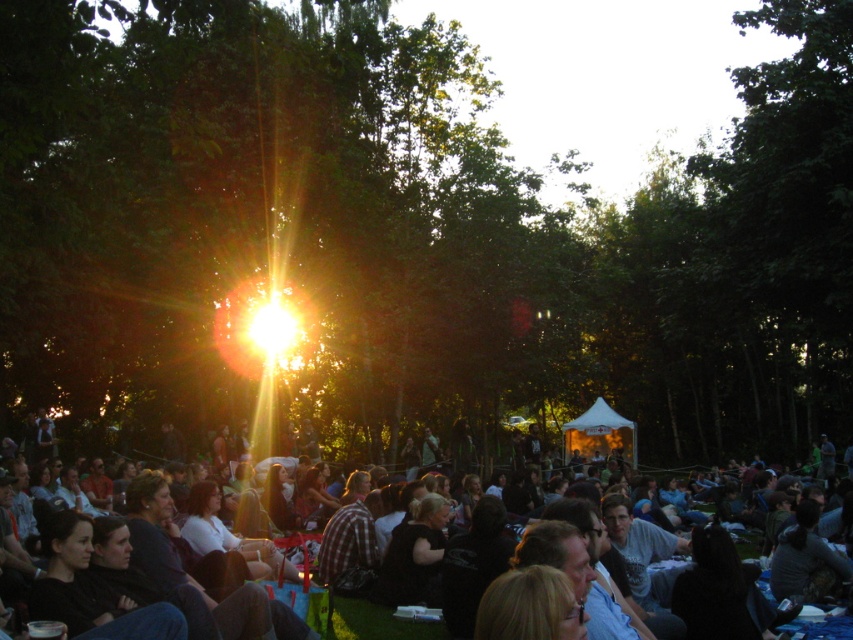
Question: Which point appears farthest from the camera in this image?

Choices:
 (A) (285, 152)
 (B) (347, 499)

Answer: (A)

Question: Is green leafy tree at center behind dark clothing crowd at lower center?

Choices:
 (A) yes
 (B) no

Answer: (A)

Question: Can you confirm if green leafy tree at center is positioned to the left of dark clothing crowd at lower center?

Choices:
 (A) no
 (B) yes

Answer: (A)

Question: From the image, what is the correct spatial relationship of green leafy tree at center in relation to dark clothing crowd at lower center?

Choices:
 (A) above
 (B) below

Answer: (A)

Question: Which of the following is the closest to the observer?

Choices:
 (A) dark clothing crowd at lower center
 (B) green leafy tree at center

Answer: (A)

Question: Which of the following is the closest to the observer?

Choices:
 (A) dark clothing crowd at lower center
 (B) green leafy tree at center

Answer: (A)